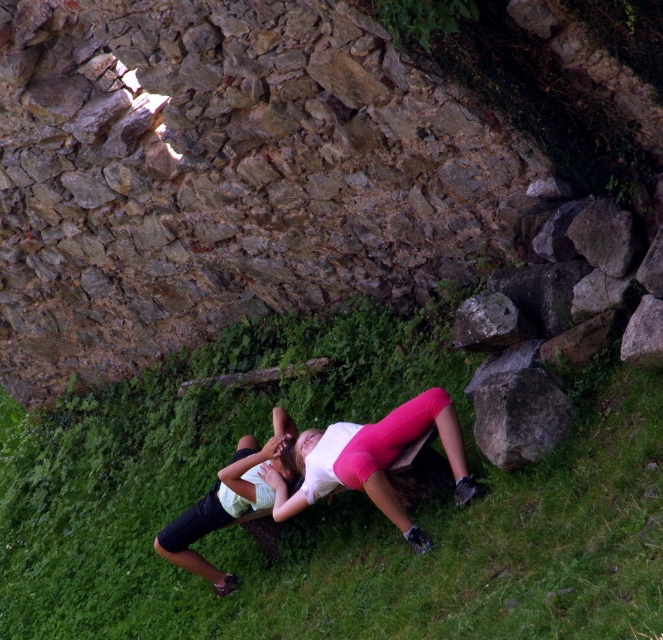
Describe the element at coordinates (328, 506) in the screenshot. I see `green grass at lower center` at that location.

Is green grass at lower center bigger than white matte shorts at lower center?

Yes, green grass at lower center is bigger than white matte shorts at lower center.

This screenshot has height=640, width=663. I want to click on green grass at lower center, so coord(328,506).

This screenshot has width=663, height=640. I want to click on green grass at lower center, so click(328, 506).

Between white matte shorts at lower center and smooth gray rock at center, which one appears on the left side from the viewer's perspective?

From the viewer's perspective, white matte shorts at lower center appears more on the left side.

Does white matte shorts at lower center appear on the left side of smooth gray rock at center?

Correct, you'll find white matte shorts at lower center to the left of smooth gray rock at center.

Is point (237, 502) in front of point (487, 320)?

No, it is not.

Identify the location of white matte shorts at lower center. The width and height of the screenshot is (663, 640). (227, 500).

Can you confirm if white matte leggings at center is positioned to the right of gray rough rock at lower right?

Incorrect, white matte leggings at center is not on the right side of gray rough rock at lower right.

Which of these two, white matte leggings at center or gray rough rock at lower right, stands shorter?

With less height is gray rough rock at lower right.

Where is `white matte leggings at center`? The width and height of the screenshot is (663, 640). white matte leggings at center is located at coordinates (373, 460).

Where is `white matte leggings at center`? white matte leggings at center is located at coordinates [373, 460].